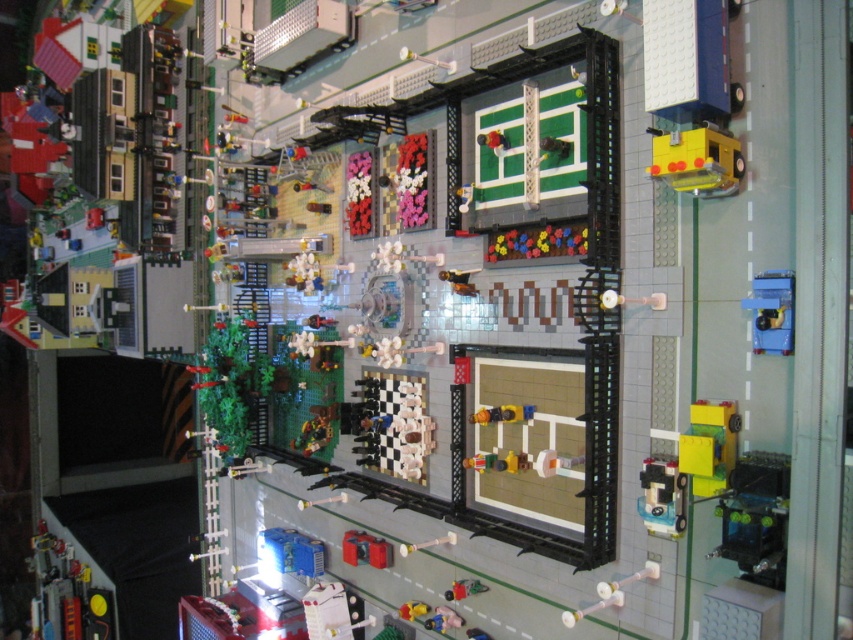
Question: Estimate the real-world distances between objects in this image. Which object is farther from the metallic silver car at bottom center?

Choices:
 (A) yellow plastic figure at center
 (B) translucent plastic car at lower right
 (C) white plastic toothbrush at center

Answer: (B)

Question: Which point is closer to the camera?

Choices:
 (A) (656, 573)
 (B) (680, 484)
 (C) (758, 291)

Answer: (C)

Question: Which point is closer to the camera taking this photo?

Choices:
 (A) (751, 291)
 (B) (461, 589)
 (C) (642, 472)

Answer: (A)

Question: Can you confirm if translucent plastic car at lower right is positioned above white plastic toothbrush at center?

Choices:
 (A) yes
 (B) no

Answer: (A)

Question: Can you confirm if translucent plastic car at lower right is positioned below yellow plastic figure at center?

Choices:
 (A) yes
 (B) no

Answer: (A)

Question: Is translucent plastic car at lower right to the right of metallic silver car at bottom center from the viewer's perspective?

Choices:
 (A) yes
 (B) no

Answer: (A)